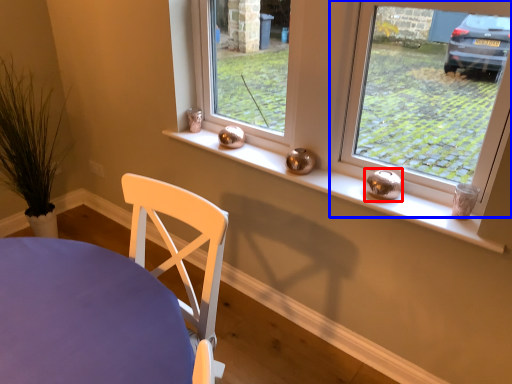
Question: Which of the following is the closest to the observer, candle holder (highlighted by a red box) or window (highlighted by a blue box)?

Choices:
 (A) candle holder
 (B) window

Answer: (B)